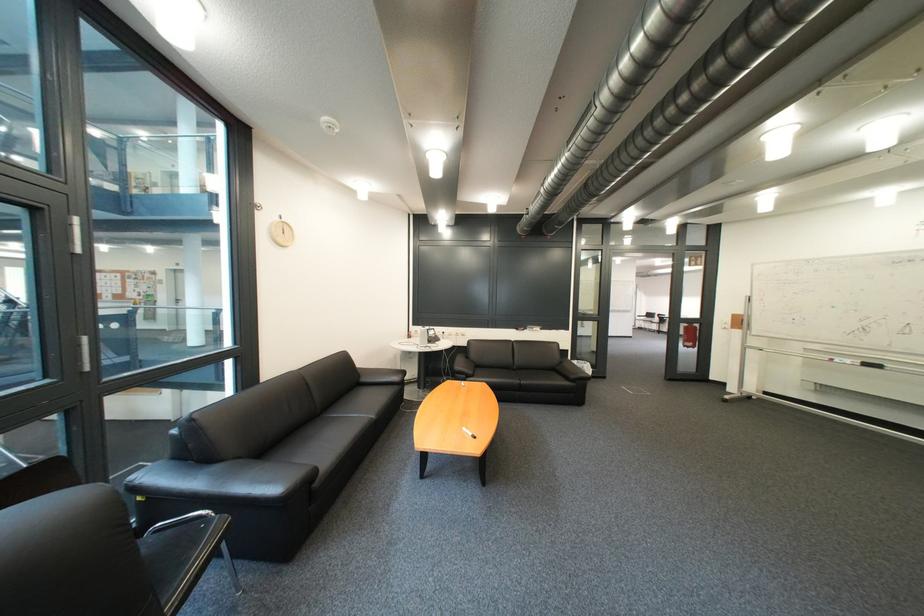
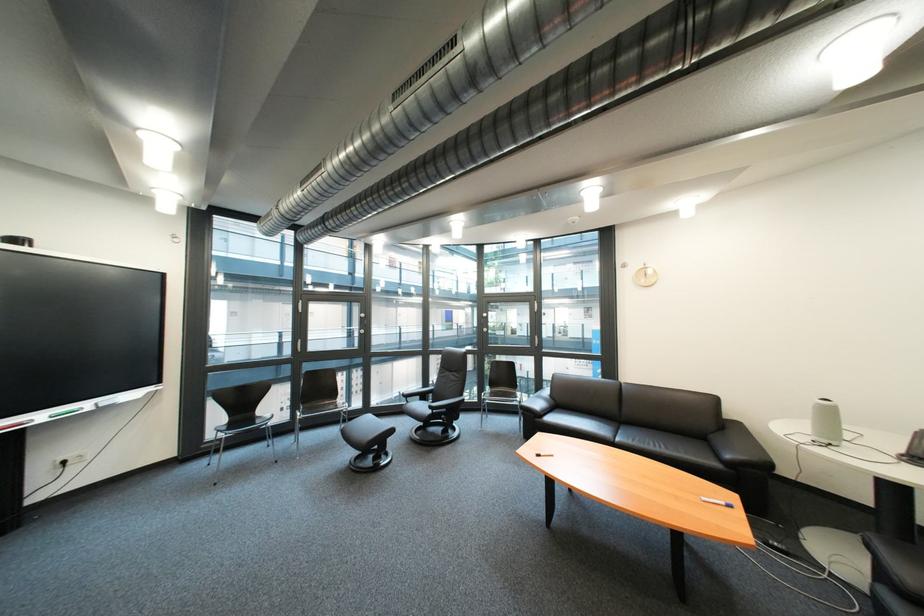
Locate, in the second image, the point that corresponds to pixel 408 381 in the first image.

(742, 458)